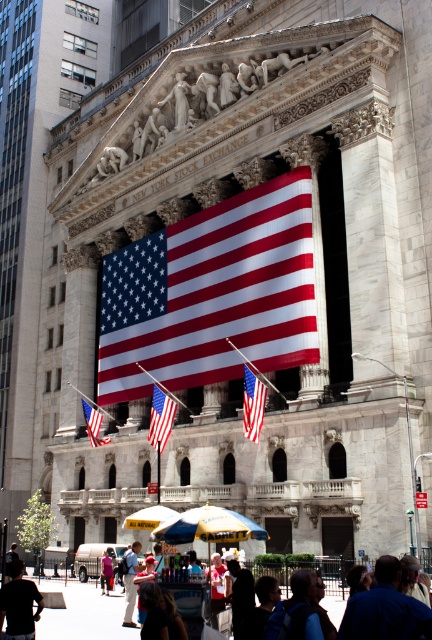
Question: Does dark blue shirt at center appear on the right side of dark blue jeans at lower left?

Choices:
 (A) yes
 (B) no

Answer: (A)

Question: Which point is closer to the camera?

Choices:
 (A) red-white-and-blue fabric flag at center
 (B) denim jacket at lower center
 (C) dark blue shirt at center
 (D) light brown leather jacket at lower center

Answer: (C)

Question: Which is nearer to the dark blue shirt at center?

Choices:
 (A) red-white striped flag at center
 (B) red-white-and-blue fabric flag at center
 (C) matte red flag at center

Answer: (B)

Question: Is the position of dark blue shirt at center less distant than that of dark blue backpack at lower center?

Choices:
 (A) no
 (B) yes

Answer: (B)

Question: Which object is closer to the camera taking this photo?

Choices:
 (A) red-white striped flag at center
 (B) denim jacket at lower center
 (C) matte red flag at center
 (D) dark blue shirt at center

Answer: (D)

Question: Does dark blue shirt at center have a lesser width compared to dark blue backpack at lower center?

Choices:
 (A) yes
 (B) no

Answer: (B)